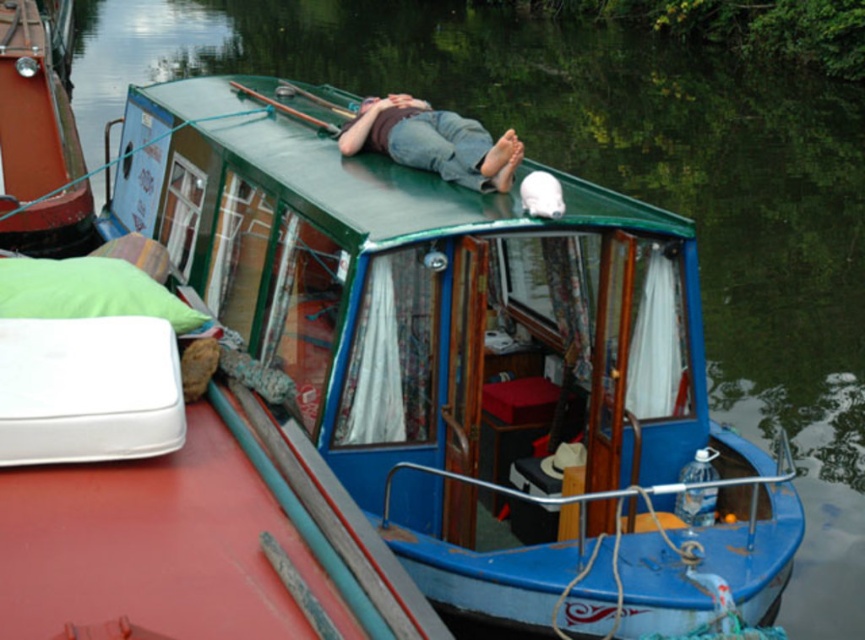
Question: Which point is closer to the camera taking this photo?

Choices:
 (A) (452, 136)
 (B) (93, 312)
 (C) (221, 436)
 (D) (674, 464)

Answer: (C)

Question: Is the position of denim jeans at center less distant than that of green fabric pillow at left?

Choices:
 (A) no
 (B) yes

Answer: (A)

Question: From the image, what is the correct spatial relationship of blue painted wooden cabin cruiser at upper center in relation to blue glossy boat at upper center?

Choices:
 (A) left
 (B) right

Answer: (B)

Question: Which of these objects is positioned farthest from the blue painted wooden cabin cruiser at upper center?

Choices:
 (A) green fabric pillow at left
 (B) blue glossy boat at upper center

Answer: (B)

Question: Among these points, which one is farthest from the camera?

Choices:
 (A) (529, 616)
 (B) (254, 467)
 (C) (459, 163)
 (D) (104, 301)

Answer: (C)

Question: Can you confirm if blue glossy boat at upper center is bigger than denim jeans at center?

Choices:
 (A) yes
 (B) no

Answer: (B)